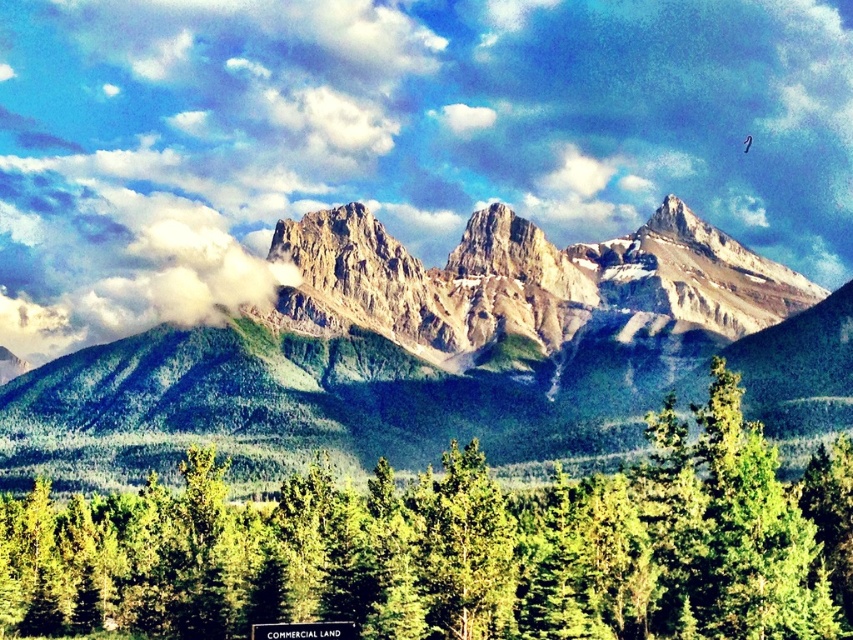
You are standing in front of the mountain range and want to take a photo. You notice two points marked in the scene. The first point is at coordinates point (245, 115) and the second point is at point (36, 401). Which point is closer to your camera?

Point (36, 401) is closer to the camera because the description states that point (245, 115) is further away than point (36, 401).

Looking at this image, looking at the mountain scene, where is the white fluffy cloud at upper center in relation to the rugged stone mountain range at center?

The white fluffy cloud at upper center is located to the left of the rugged stone mountain range at center.

You are a photographer planning to capture the entire mountain range in a single shot. You notice the white fluffy cloud at upper center and the green matte pine forest at lower center. Which object would you need to adjust your camera angle to include if they are both in the frame?

The white fluffy cloud at upper center might be wider than the green matte pine forest at lower center, so you might need to adjust your camera angle to include the white fluffy cloud at upper center in the frame.